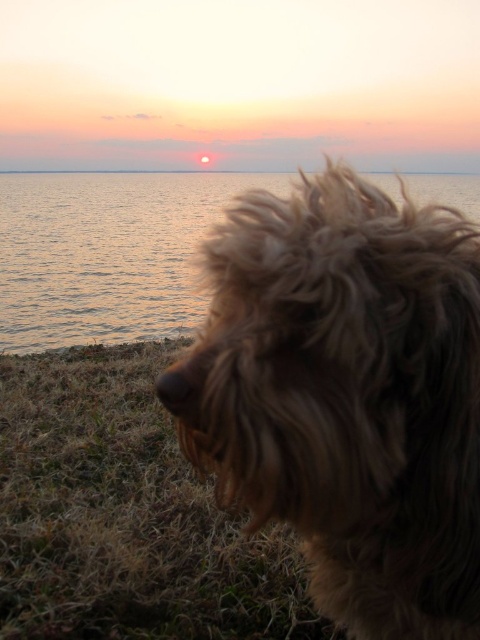
Looking at this image, you are a photographer standing at the edge of the beach. You want to take a photo of the fuzzy brown dog at center and the smooth ocean at center in the same frame. Given that your camera has a minimum focus distance of 10 meters, can you capture both subjects clearly without moving closer than 10 meters?

The fuzzy brown dog at center and smooth ocean at center are 13.66 meters apart from each other. Since the distance between them is greater than the camera minimum focus distance of 10 meters, you can capture both subjects clearly without moving closer than 10 meters.